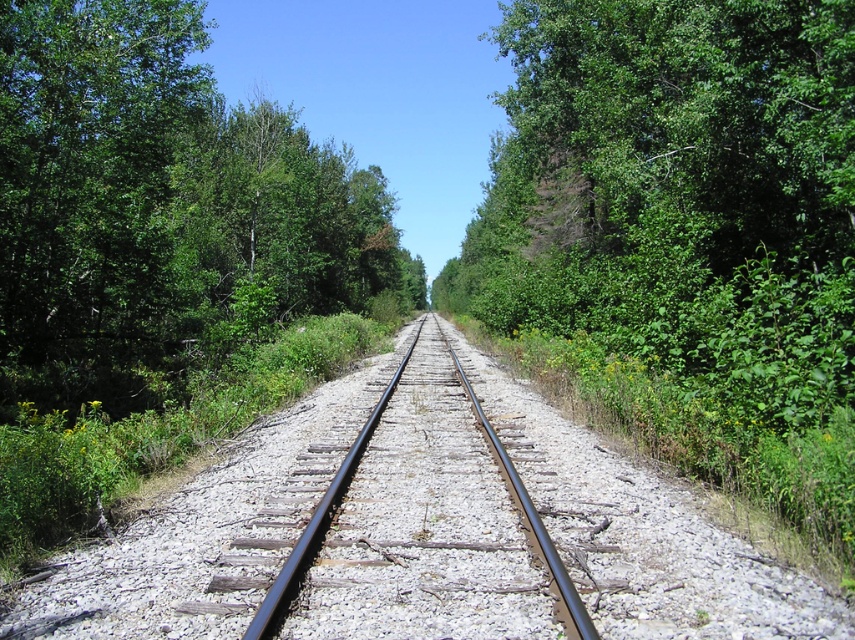
In the scene shown: You are standing at the point marked as point [158,208] in the image. Looking around, you see a green leafy tree at center. Which direction should you walk to reach the green leafy tree at center?

The point [158,208] is already on the green leafy tree at center, so you are already at the tree and do not need to move.

You are standing at the origin point of a coordinate system placed at the bottom left corner of the image. The railway tracks run horizontally from left to right. If you want to walk directly towards the green leafy tree at center, in which direction should you move relative to the tracks?

The green leafy tree at center is located at coordinates approximately 0.325 on the x and 0.187 on the y axis. Since the tracks run horizontally from left to right, moving towards the tree would require moving northeast, as the tree is positioned northeast relative to the origin point.

Looking at this image, you are a bird flying over a railway track. You see a green leafy tree at center and a black metal train track at center. Which object is higher from the ground?

The green leafy tree at center is above the black metal train track at center, so the green leafy tree at center is higher from the ground.